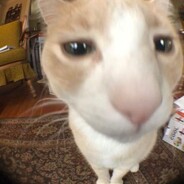
Locate an element on the screen. brown and white designed rectangular rug is located at coordinates (45, 158).